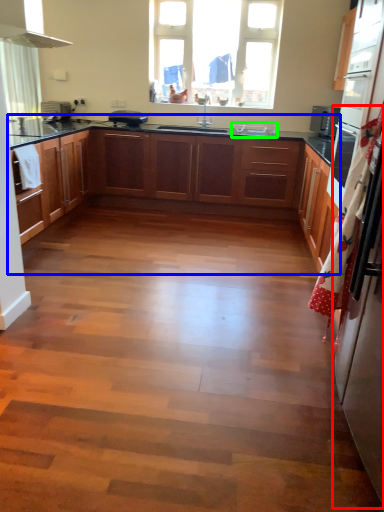
Question: Considering the real-world distances, which object is closest to fridge (highlighted by a red box)? cabinetry (highlighted by a blue box) or sink (highlighted by a green box).

Choices:
 (A) cabinetry
 (B) sink

Answer: (A)